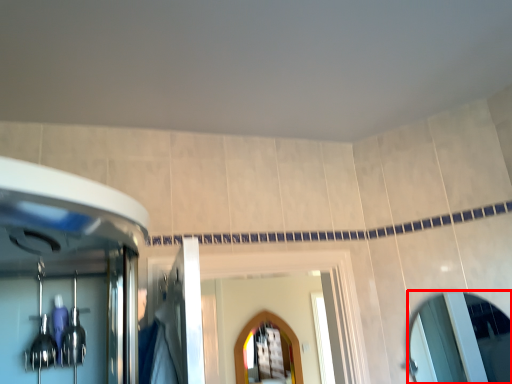
Question: In this image, where is mirror (annotated by the red box) located relative to mirror?

Choices:
 (A) right
 (B) left

Answer: (A)